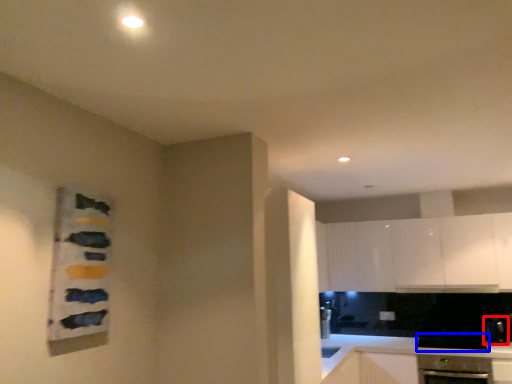
Question: Which point is further to the camera, appliance (highlighted by a red box) or appliance (highlighted by a blue box)?

Choices:
 (A) appliance
 (B) appliance

Answer: (A)